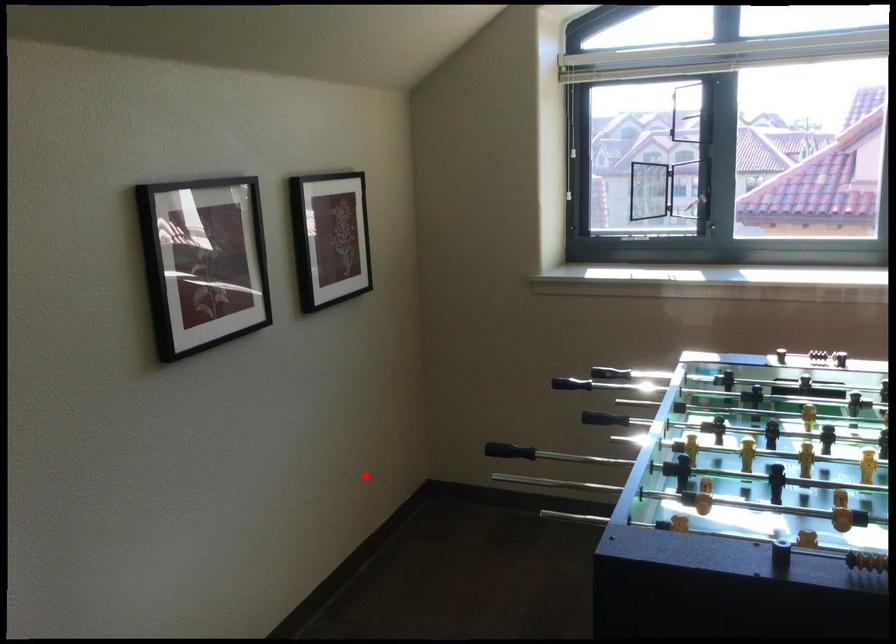
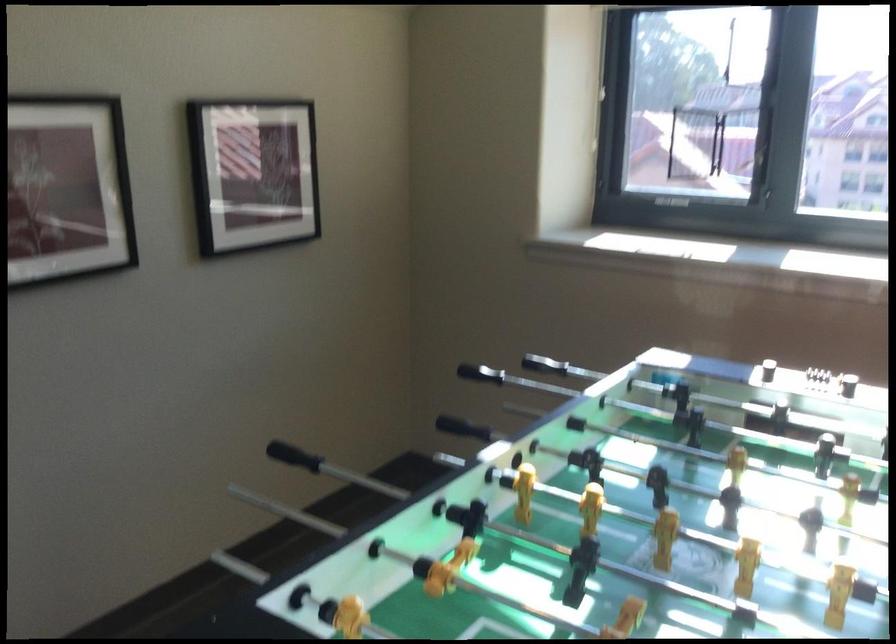
Locate, in the second image, the point that corresponds to the highlighted location in the first image.

(294, 456)